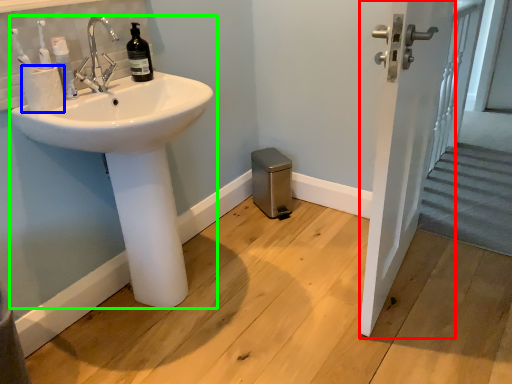
Question: Which object is the closest to the screen door (highlighted by a red box)? Choose among these: toilet paper (highlighted by a blue box) or sink (highlighted by a green box).

Choices:
 (A) toilet paper
 (B) sink

Answer: (B)